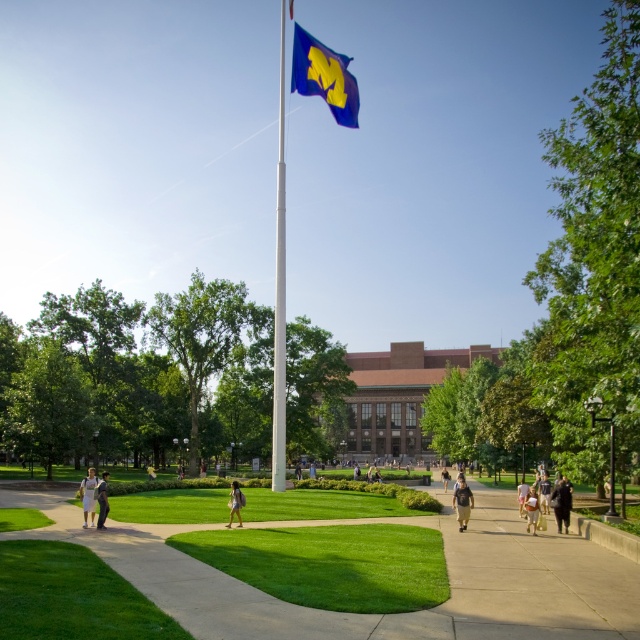
Measure the distance between white cotton dress at lower left and camera.

The distance of white cotton dress at lower left from camera is 60.19 feet.

Between white cotton dress at lower left and light brown leather backpack at lower center, which one is positioned lower?

light brown leather backpack at lower center is lower down.

Is point (83, 524) positioned after point (529, 513)?

That is False.

Find the location of a particular element. Image resolution: width=640 pixels, height=640 pixels. white cotton dress at lower left is located at coordinates (88, 497).

Is light brown leather jacket at center smaller than light pink fabric dress at center?

Indeed, light brown leather jacket at center has a smaller size compared to light pink fabric dress at center.

Does light brown leather jacket at center have a lesser width compared to light pink fabric dress at center?

Yes.

Is point (228, 518) positioned behind point (522, 508)?

No, (228, 518) is closer to viewer.

The width and height of the screenshot is (640, 640). In order to click on light brown leather jacket at center in this screenshot , I will do `click(236, 502)`.

Does white glossy flag pole at center have a lesser width compared to blue matte flag at upper center?

No, white glossy flag pole at center is not thinner than blue matte flag at upper center.

Which is above, white glossy flag pole at center or blue matte flag at upper center?

white glossy flag pole at center

Does point (276, 166) lie behind point (326, 54)?

Yes, it is behind point (326, 54).

Where is `white glossy flag pole at center`? white glossy flag pole at center is located at coordinates (280, 292).